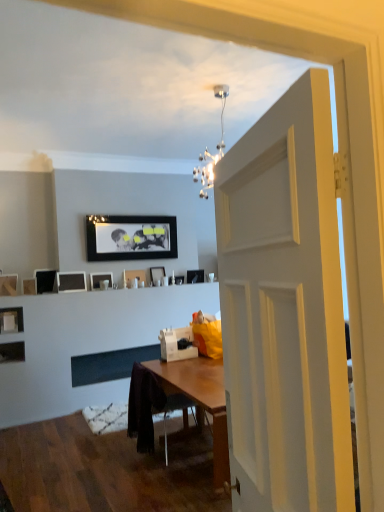
Question: Is matte black picture frame at left, acting as the tenth picture frame starting from the right, smaller than matte black picture frame at upper center, which is counted as the first picture frame, starting from the right?

Choices:
 (A) no
 (B) yes

Answer: (B)

Question: Considering the relative sizes of matte black picture frame at left, which is the second picture frame in left-to-right order, and matte black picture frame at upper center, placed as the eleventh picture frame when sorted from left to right, in the image provided, is matte black picture frame at left, which is the second picture frame in left-to-right order, taller than matte black picture frame at upper center, placed as the eleventh picture frame when sorted from left to right,?

Choices:
 (A) yes
 (B) no

Answer: (A)

Question: From the image's perspective, is matte black picture frame at left, acting as the tenth picture frame starting from the right, beneath matte black picture frame at upper center, placed as the eleventh picture frame when sorted from left to right?

Choices:
 (A) no
 (B) yes

Answer: (B)

Question: Does matte black picture frame at left, acting as the tenth picture frame starting from the right, touch matte black picture frame at upper center, placed as the eleventh picture frame when sorted from left to right?

Choices:
 (A) no
 (B) yes

Answer: (A)

Question: Is matte black picture frame at left, which is the second picture frame in left-to-right order, at the left side of matte black picture frame at upper center, placed as the eleventh picture frame when sorted from left to right?

Choices:
 (A) no
 (B) yes

Answer: (B)

Question: Is matte black picture frame at left, acting as the tenth picture frame starting from the right, to the left or to the right of matte black picture frame at center, the 5th picture frame from the left, in the image?

Choices:
 (A) left
 (B) right

Answer: (A)

Question: Considering the positions of matte black picture frame at left, which is the second picture frame in left-to-right order, and matte black picture frame at center, placed as the seventh picture frame when sorted from right to left, in the image, is matte black picture frame at left, which is the second picture frame in left-to-right order, bigger or smaller than matte black picture frame at center, placed as the seventh picture frame when sorted from right to left,?

Choices:
 (A) small
 (B) big

Answer: (A)

Question: Choose the correct answer: Is matte black picture frame at left, acting as the tenth picture frame starting from the right, inside matte black picture frame at center, the 5th picture frame from the left, or outside it?

Choices:
 (A) outside
 (B) inside

Answer: (A)

Question: Is point (3, 329) closer or farther from the camera than point (84, 289)?

Choices:
 (A) farther
 (B) closer

Answer: (B)

Question: In terms of height, does matte black picture frame at center, the 5th picture frame from the left, look taller or shorter compared to wooden picture frame at left, which is counted as the 9th picture frame, starting from the right?

Choices:
 (A) tall
 (B) short

Answer: (A)

Question: Is matte black picture frame at center, the 5th picture frame from the left, bigger or smaller than wooden picture frame at left, the 3th picture frame in the left-to-right sequence?

Choices:
 (A) small
 (B) big

Answer: (B)

Question: Considering their positions, is matte black picture frame at center, the 5th picture frame from the left, located in front of or behind wooden picture frame at left, the 3th picture frame in the left-to-right sequence?

Choices:
 (A) behind
 (B) front

Answer: (A)

Question: From a real-world perspective, relative to wooden picture frame at left, the 3th picture frame in the left-to-right sequence, is matte black picture frame at center, placed as the seventh picture frame when sorted from right to left, vertically above or below?

Choices:
 (A) above
 (B) below

Answer: (A)

Question: Visually, is matte black picture frame at center, the tenth picture frame viewed from the left, positioned to the left or to the right of wooden picture frame at left, the 3th picture frame in the left-to-right sequence?

Choices:
 (A) left
 (B) right

Answer: (B)

Question: In terms of width, does matte black picture frame at center, the tenth picture frame viewed from the left, look wider or thinner when compared to wooden picture frame at left, the 3th picture frame in the left-to-right sequence?

Choices:
 (A) wide
 (B) thin

Answer: (B)